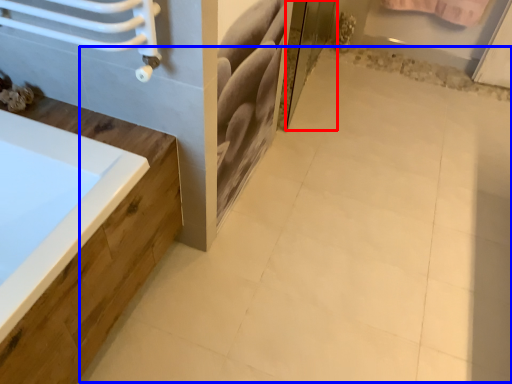
Question: Which object is further to the camera taking this photo, screen door (highlighted by a red box) or ceramic tile (highlighted by a blue box)?

Choices:
 (A) screen door
 (B) ceramic tile

Answer: (A)